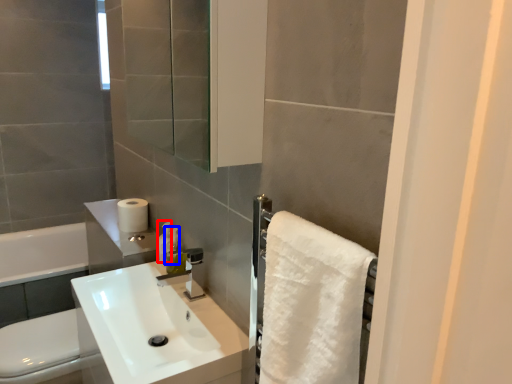
Question: Among these objects, which one is farthest to the camera, toiletry (highlighted by a red box) or soap dispenser (highlighted by a blue box)?

Choices:
 (A) toiletry
 (B) soap dispenser

Answer: (A)